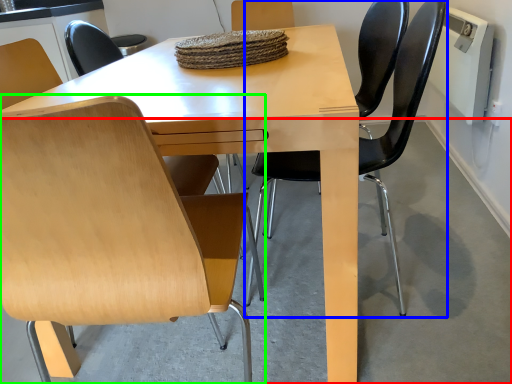
Question: Which object is positioned closest to concrete (highlighted by a red box)? Select from chair (highlighted by a blue box) and chair (highlighted by a green box).

Choices:
 (A) chair
 (B) chair

Answer: (A)